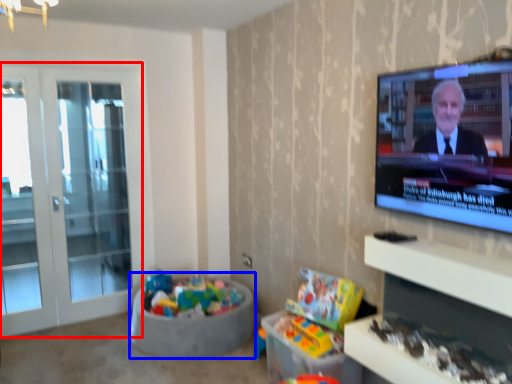
Question: Among these objects, which one is farthest to the camera, screen door (highlighted by a red box) or bean bag chair (highlighted by a blue box)?

Choices:
 (A) screen door
 (B) bean bag chair

Answer: (A)